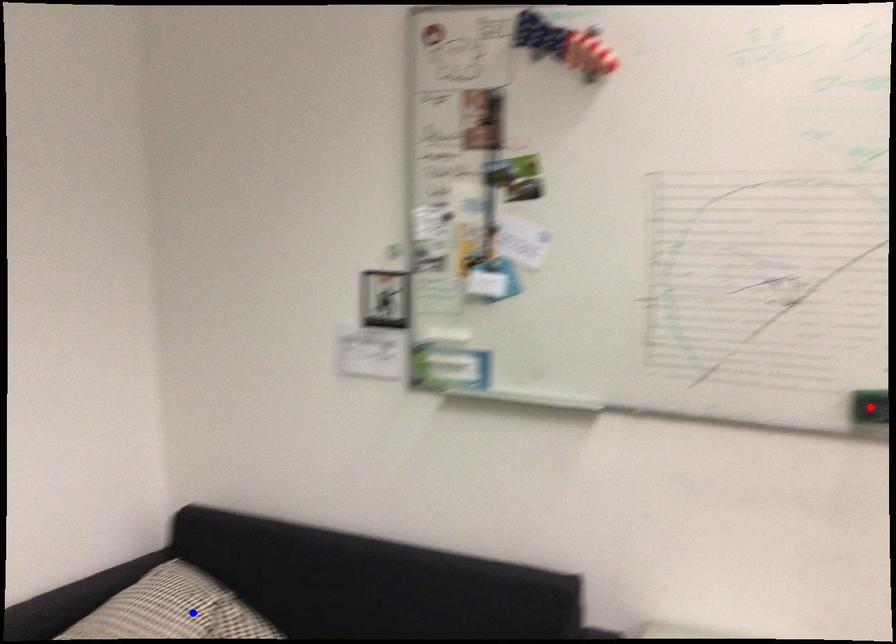
Question: In the image, two points are highlighted. Which point is nearer to the camera? Reply with the corresponding letter.

Choices:
 (A) blue point
 (B) red point

Answer: (B)